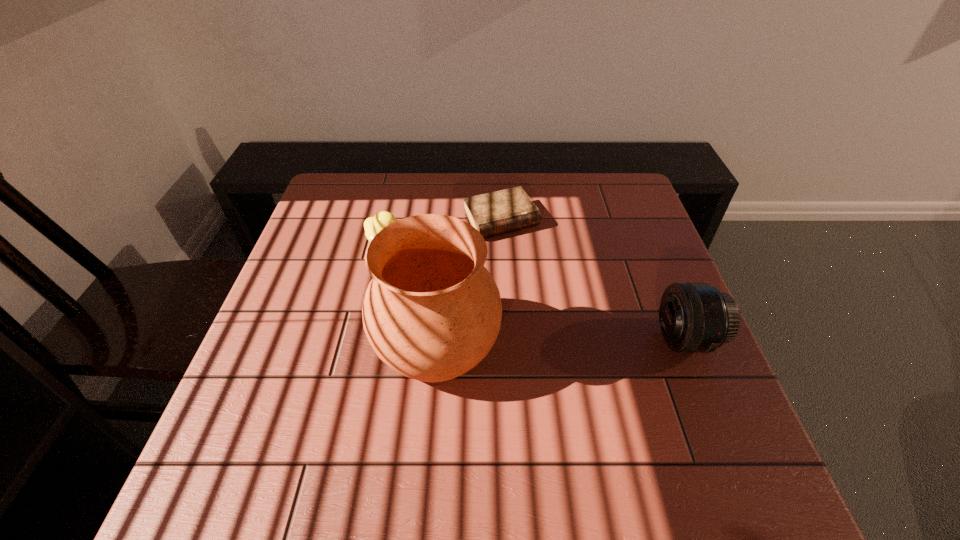
This screenshot has width=960, height=540. I want to click on free space on the desktop that is between the tallest object and the second tallest object and is positioned on the beak of the duckling, so click(x=564, y=342).

Image resolution: width=960 pixels, height=540 pixels. I want to click on vacant space on the desktop that is between the pottery and the rightmost object and is positioned on the spine side of the shortest object, so coord(581,342).